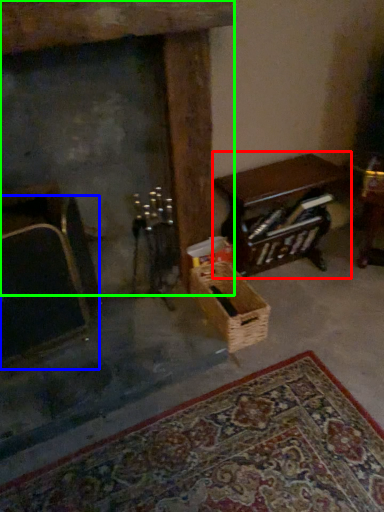
Question: Which object is the farthest from table (highlighted by a red box)? Choose among these: armchair (highlighted by a blue box) or fireplace (highlighted by a green box).

Choices:
 (A) armchair
 (B) fireplace

Answer: (A)